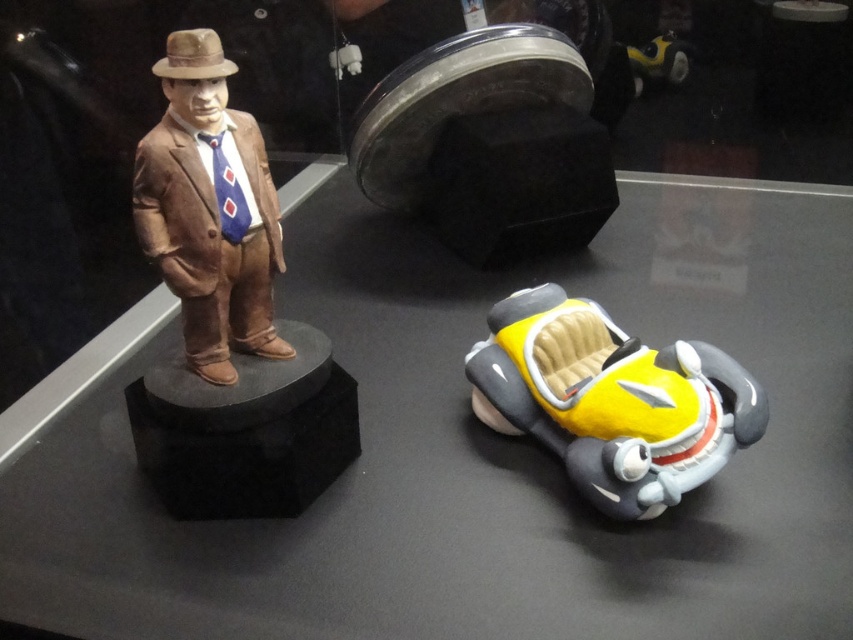
You are a museum curator checking the display case. The yellow matte car at lower right and the matte brown statue at left are both on the same reflective surface. Which object has a greater height?

The matte brown statue at left is taller than the yellow matte car at lower right, so it has a greater height.

You are a visitor at a museum exhibit and want to take a photo of the yellow matte car at lower right without any reflections from the glass case. The camera you are using has a maximum focus range of 38 inches. Can you take the photo from your current position?

The yellow matte car at lower right is 37.53 inches away from viewer. Since the distance is within the camera maximum focus range of 38 inches, you can take the photo from your current position.

You are a museum visitor standing in front of a glass case displaying two items. You see the yellow matte car at lower right and the matte brown statue at left. Which item is closer to you as you look at the glass case?

The yellow matte car at lower right is closer to you because it is further to the viewer than the matte brown statue at left.